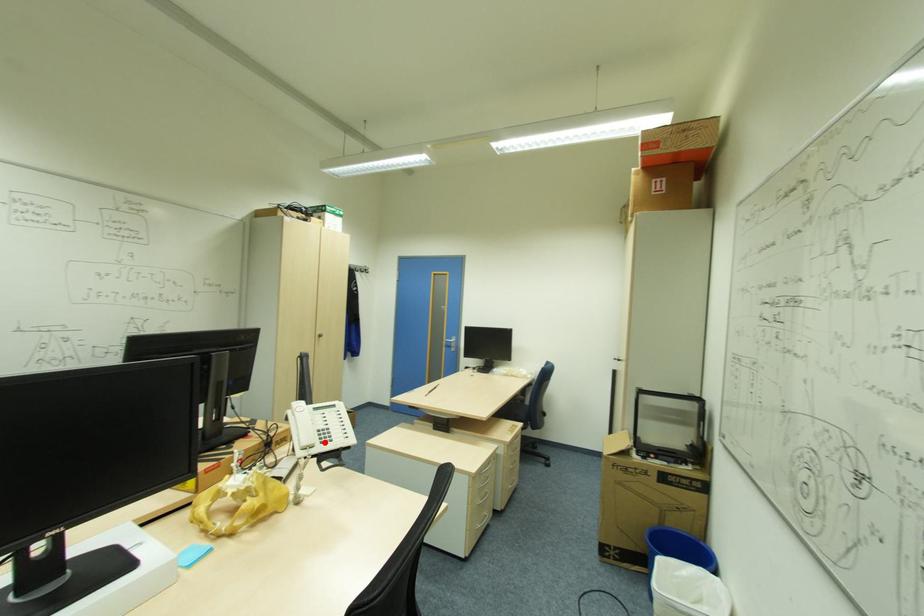
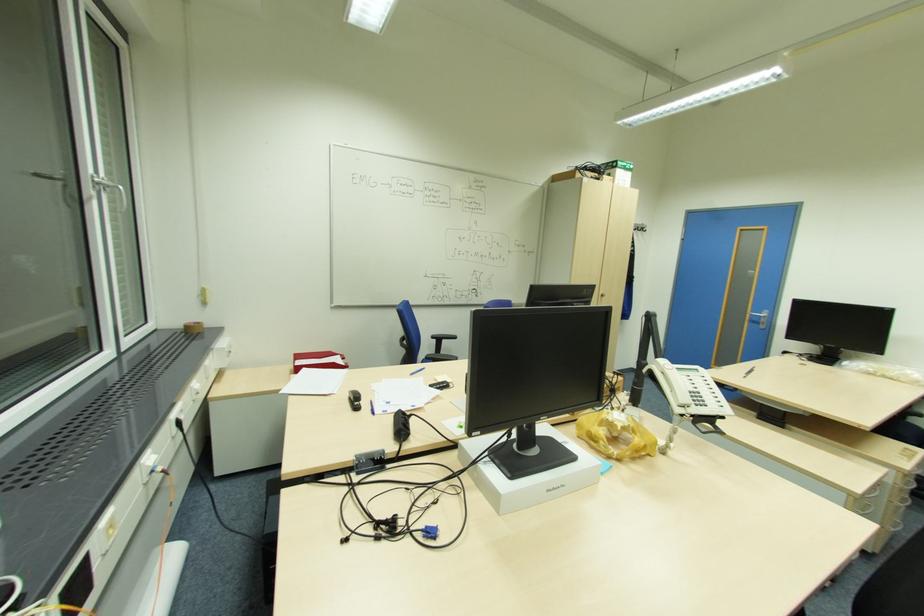
The point at the highlighted location is marked in the first image. Where is the corresponding point in the second image?

(699, 403)